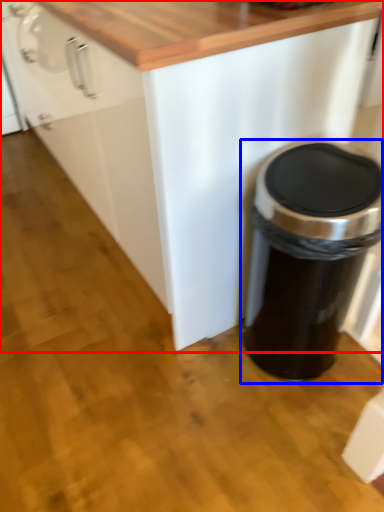
Question: Which object is further to the camera taking this photo, cabinetry (highlighted by a red box) or waste container (highlighted by a blue box)?

Choices:
 (A) cabinetry
 (B) waste container

Answer: (B)